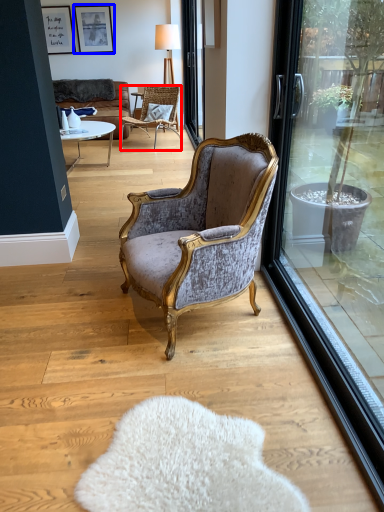
Question: Which of the following is the farthest to the observer, chair (highlighted by a red box) or picture frame (highlighted by a blue box)?

Choices:
 (A) chair
 (B) picture frame

Answer: (B)